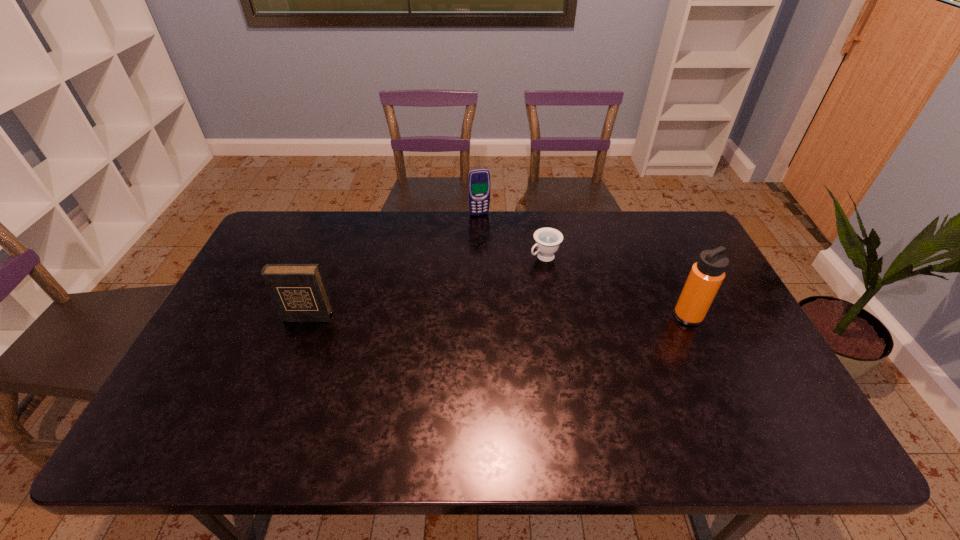
Image resolution: width=960 pixels, height=540 pixels. Find the location of `diary`. diary is located at coordinates (298, 291).

Locate an element on the screen. The height and width of the screenshot is (540, 960). the rightmost object is located at coordinates (707, 274).

You are a GUI agent. You are given a task and a screenshot of the screen. Output one action in this format:
    pyautogui.click(x=<x>, y=<y>)
    Task: Click on the tallest object
    
    Given the screenshot: What is the action you would take?
    click(707, 274)

Find the location of `the shortest object`. the shortest object is located at coordinates (547, 240).

At what (x,y) coordinates should I click in order to perform the action: click on the second object from right to left. Please return your answer as a coordinate pair (x, y). The image size is (960, 540). Looking at the image, I should click on (547, 240).

This screenshot has height=540, width=960. Find the location of `the second object from left to right`. the second object from left to right is located at coordinates (478, 179).

Where is `cellular telephone`? The width and height of the screenshot is (960, 540). cellular telephone is located at coordinates (478, 179).

Image resolution: width=960 pixels, height=540 pixels. What are the coordinates of `vacant region located on the front cover of the diary` in the screenshot? It's located at (281, 384).

Image resolution: width=960 pixels, height=540 pixels. I want to click on vacant space located on the back of the thermos bottle, so click(656, 247).

Locate an element on the screen. The image size is (960, 540). vacant region located 0.160m on the side of the second farthest object with the handle is located at coordinates (496, 287).